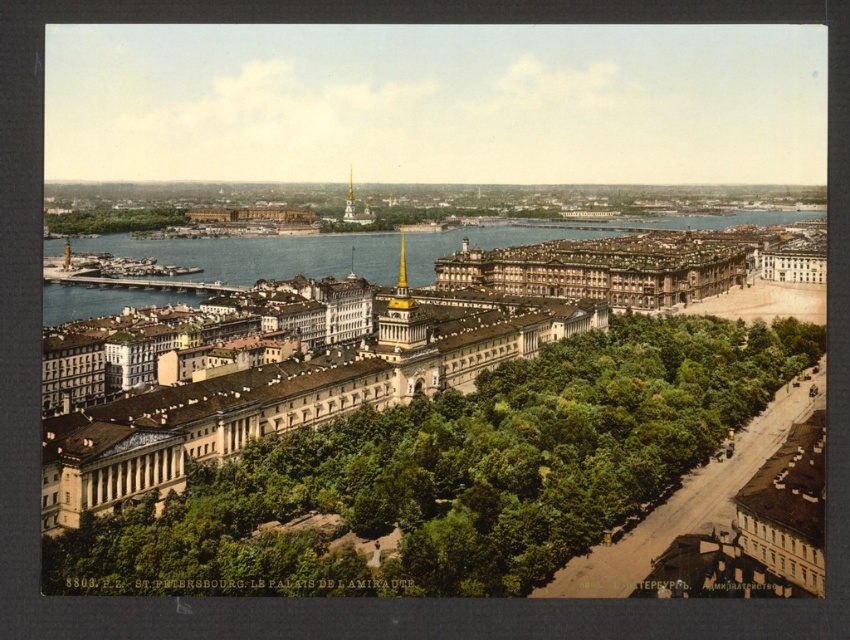
You are a city planner analyzing the layout of St. Petersburg. You need to determine if the white stone palace at center can be expanded to match the width of the blue water at center. Based on the current dimensions, is this possible?

The white stone palace at center is currently narrower than the blue water at center. Since the palace is less wide, it could potentially be expanded to match the blue water at center if there is sufficient space available and no structural or legal restrictions.

You are a tourist in St. Petersburg and want to take a photo of the green leafy trees at left and the blue water at center. From which side of the trees should you position yourself to include both elements in the frame?

You should position yourself to the right of the green leafy trees at left because the blue water at center is located to the right of them, allowing both elements to be captured in the same frame.